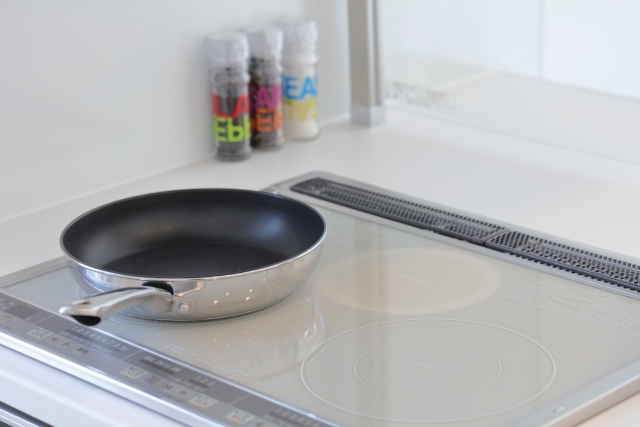
This screenshot has width=640, height=427. Find the location of `glass`. glass is located at coordinates (566, 43).